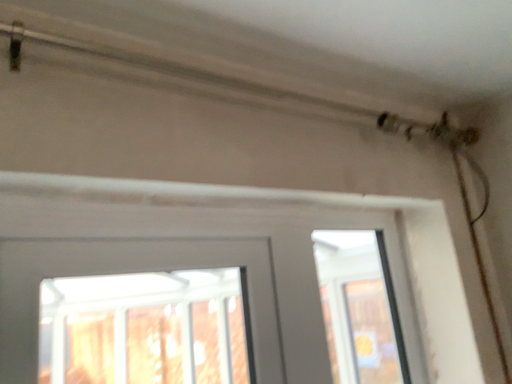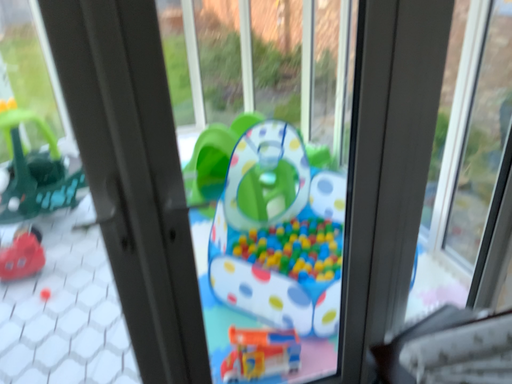
Question: Which way did the camera rotate in the video?

Choices:
 (A) rotated left
 (B) rotated right

Answer: (A)